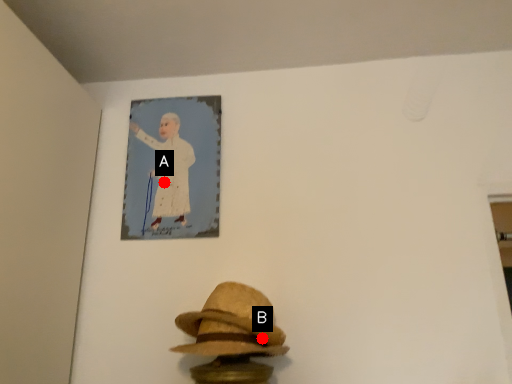
Question: Two points are circled on the image, labeled by A and B beside each circle. Which point is closer to the camera?

Choices:
 (A) A is closer
 (B) B is closer

Answer: (B)